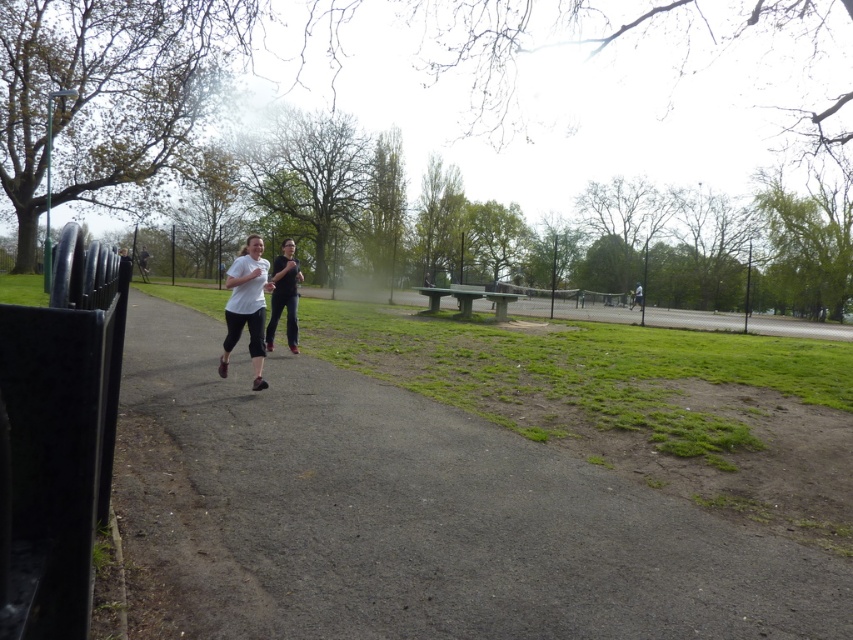
Consider the image. You are standing at the edge of the gray asphalt path at center and want to walk towards the black matte pants at center. Which direction should you face to move directly towards them?

You should face to the left because the gray asphalt path at center is on the right side of the black matte pants at center, so moving towards the left will bring you closer to the black matte pants at center.

You are standing at the point with coordinates [410,516] in the park. What is the surface material under your feet?

The surface material at point [410,516] is gray asphalt path at center.